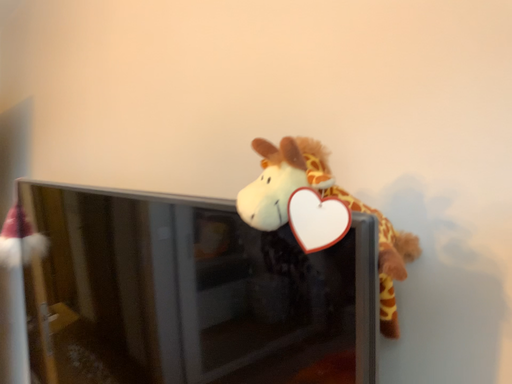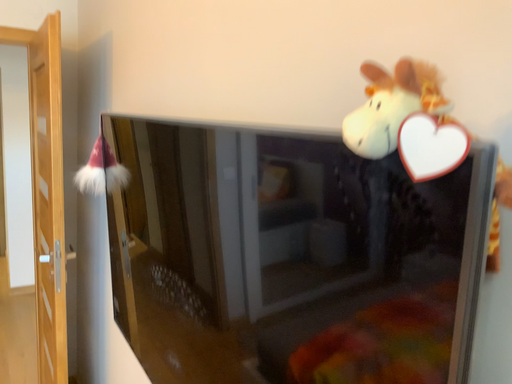
Question: How did the camera likely rotate when shooting the video?

Choices:
 (A) rotated right
 (B) rotated left

Answer: (B)